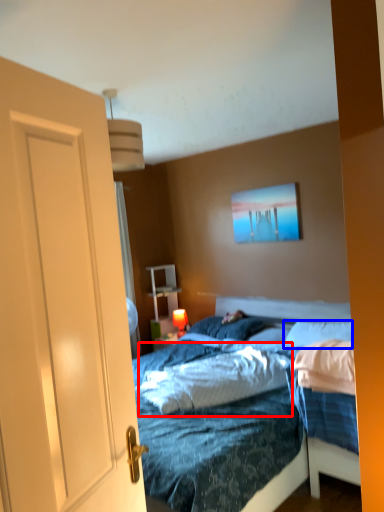
Question: Which object appears closest to the camera in this image, mattress (highlighted by a red box) or pillow (highlighted by a blue box)?

Choices:
 (A) mattress
 (B) pillow

Answer: (A)